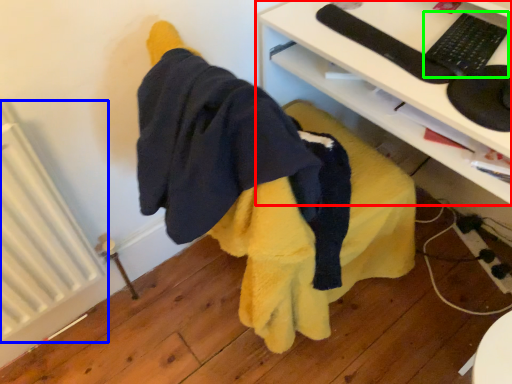
Question: Estimate the real-world distances between objects in this image. Which object is closer to desk (highlighted by a red box), radiator (highlighted by a blue box) or keyboard (highlighted by a green box)?

Choices:
 (A) radiator
 (B) keyboard

Answer: (B)